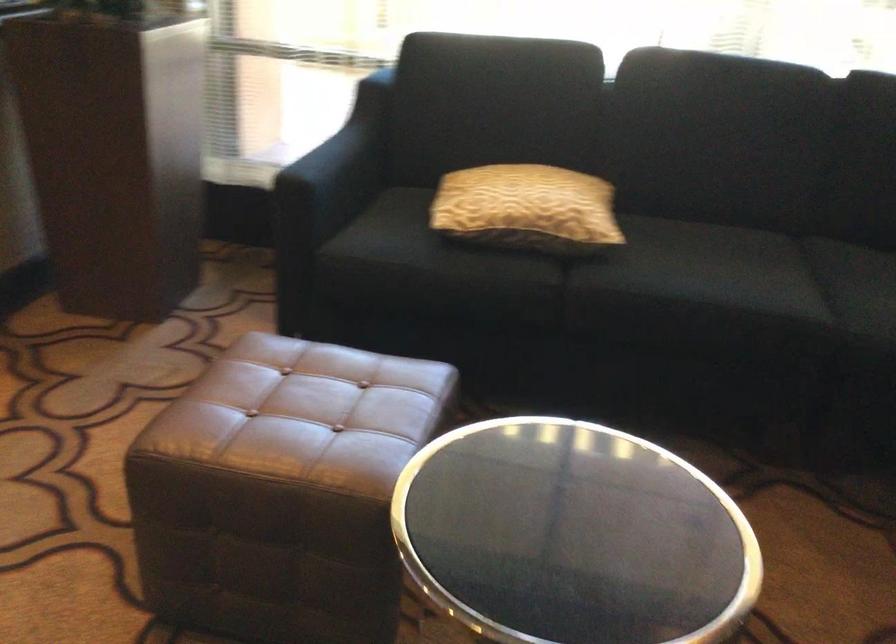
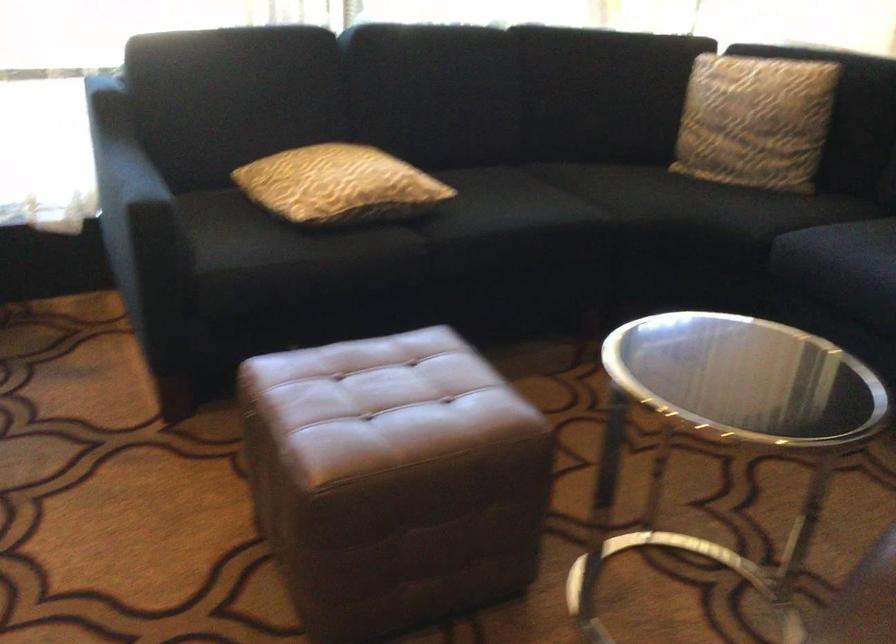
Question: Based on the continuous images, in which direction is the camera rotating? Reply with the corresponding letter.

Choices:
 (A) Left
 (B) Right
 (C) Up
 (D) Down

Answer: (B)